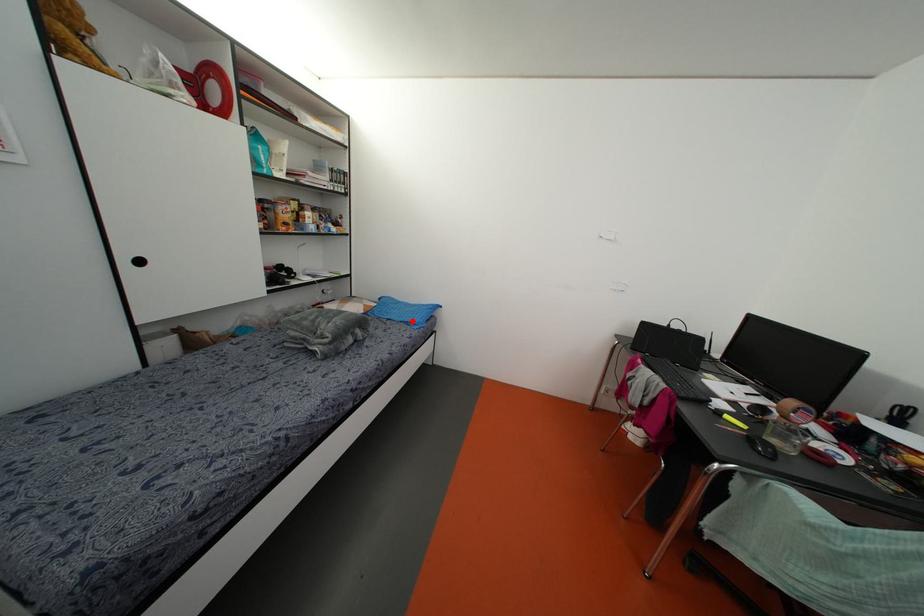
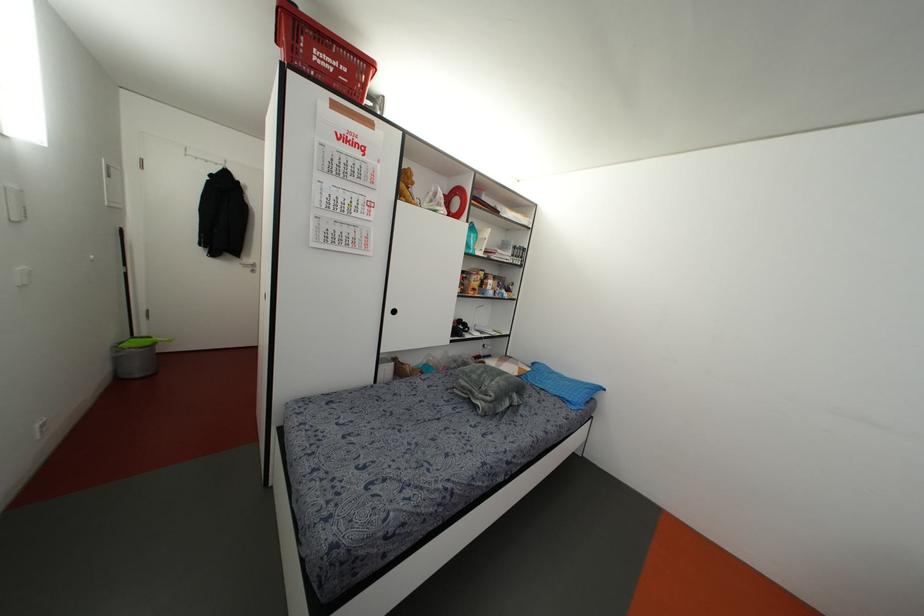
In the second image, find the point that corresponds to the highlighted location in the first image.

(569, 399)